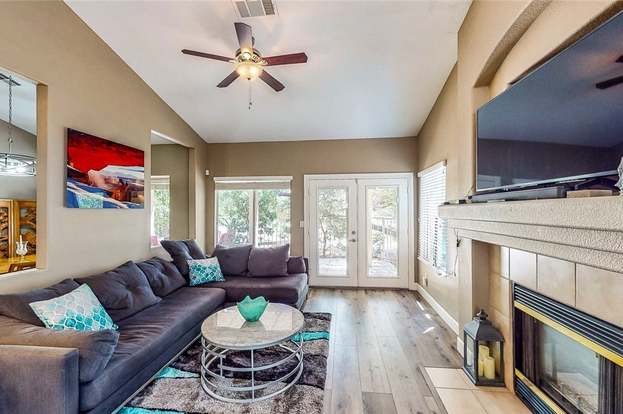
Locate an element on the screen. The height and width of the screenshot is (414, 623). couch is located at coordinates (178, 304).